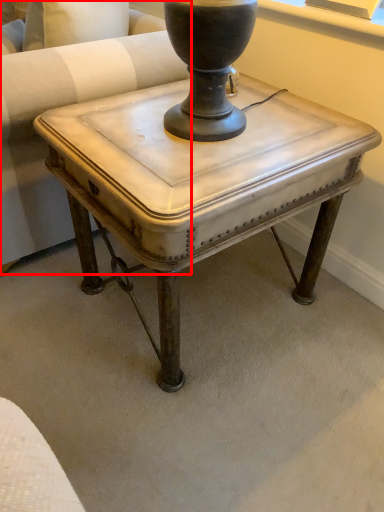
Question: Where is swivel chair (annotated by the red box) located in relation to table in the image?

Choices:
 (A) right
 (B) left

Answer: (B)